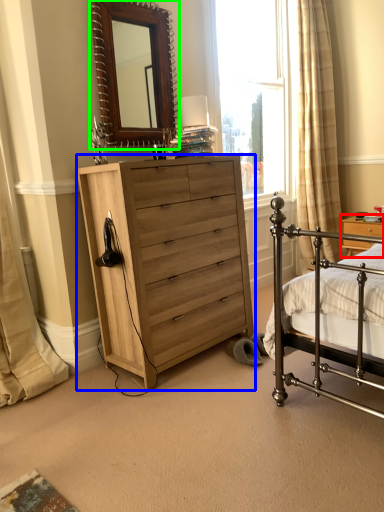
Question: Which is farther away from nightstand (highlighted by a red box)? chest of drawers (highlighted by a blue box) or mirror (highlighted by a green box)?

Choices:
 (A) chest of drawers
 (B) mirror

Answer: (B)